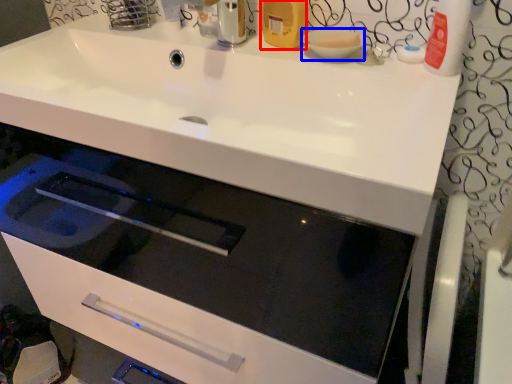
Question: Which point is closer to the camera, toiletry (highlighted by a red box) or basin (highlighted by a blue box)?

Choices:
 (A) toiletry
 (B) basin

Answer: (B)